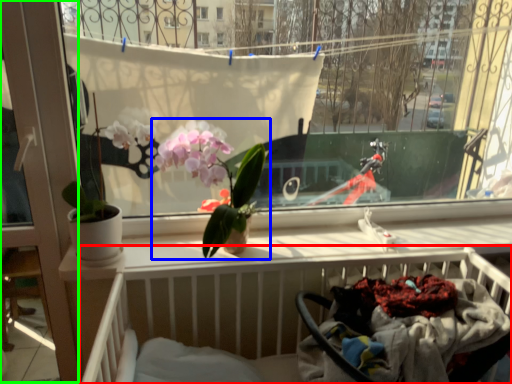
Question: Which is nearer to the hospital bed (highlighted by a red box)? houseplant (highlighted by a blue box) or screen door (highlighted by a green box).

Choices:
 (A) houseplant
 (B) screen door

Answer: (A)